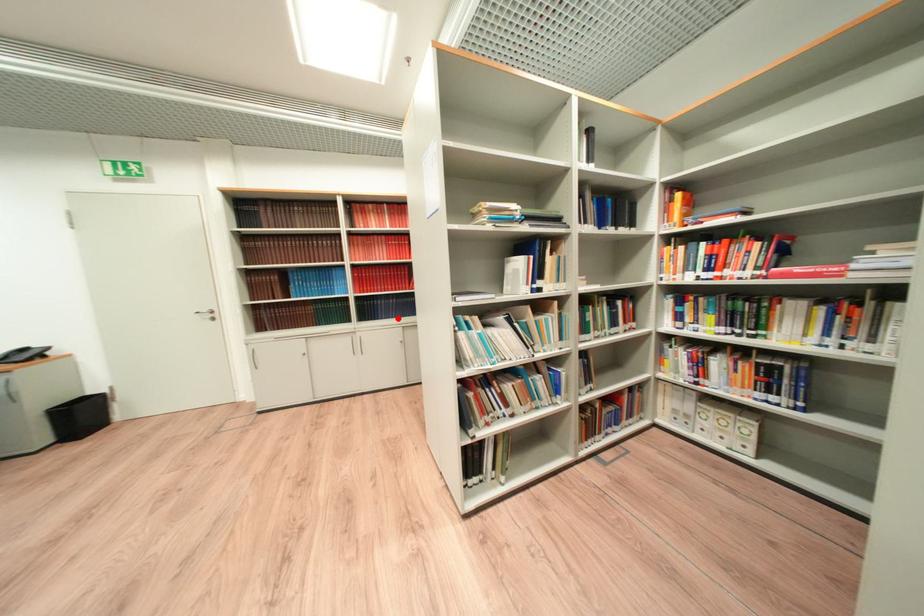
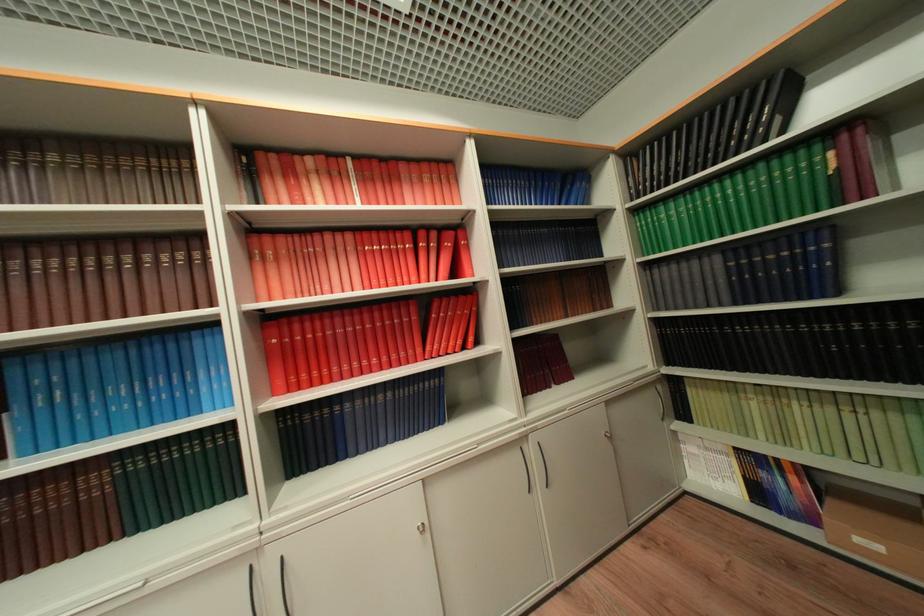
Question: I am providing you with two images of the same scene from different viewpoints. A red point is marked on the first image. Is the red point's position out of view in image 2?

Choices:
 (A) Yes
 (B) No

Answer: (B)